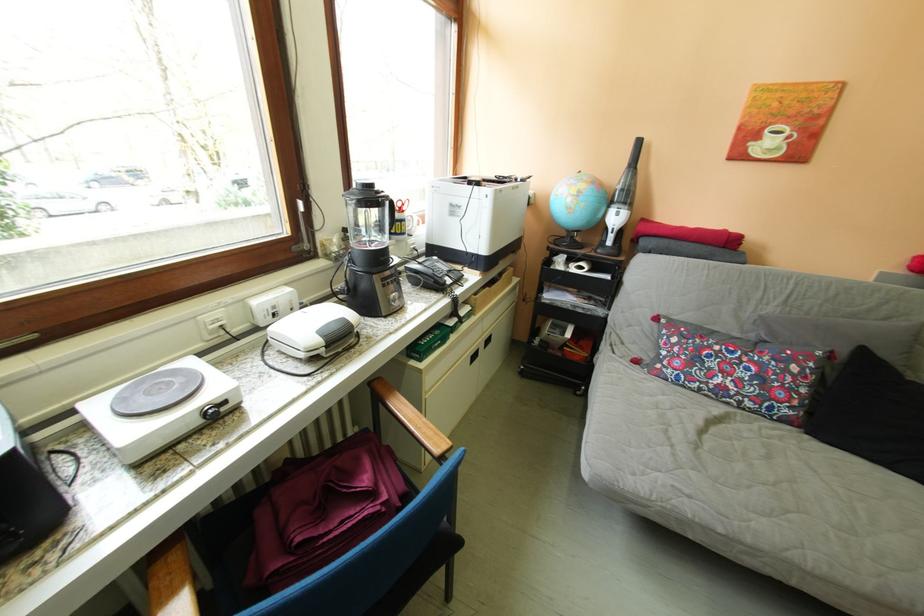
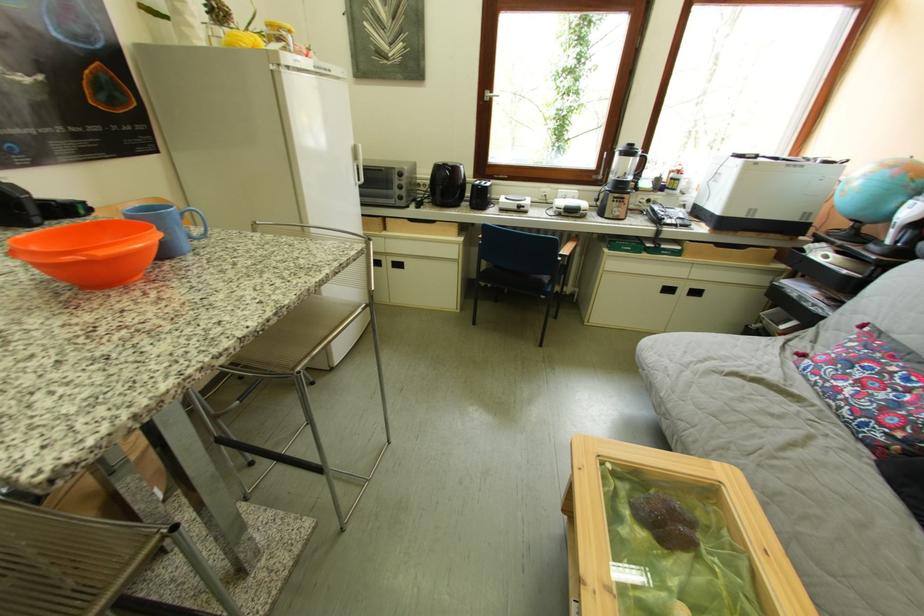
Locate, in the second image, the point that corresponds to the point at 714,373 in the first image.

(849, 374)